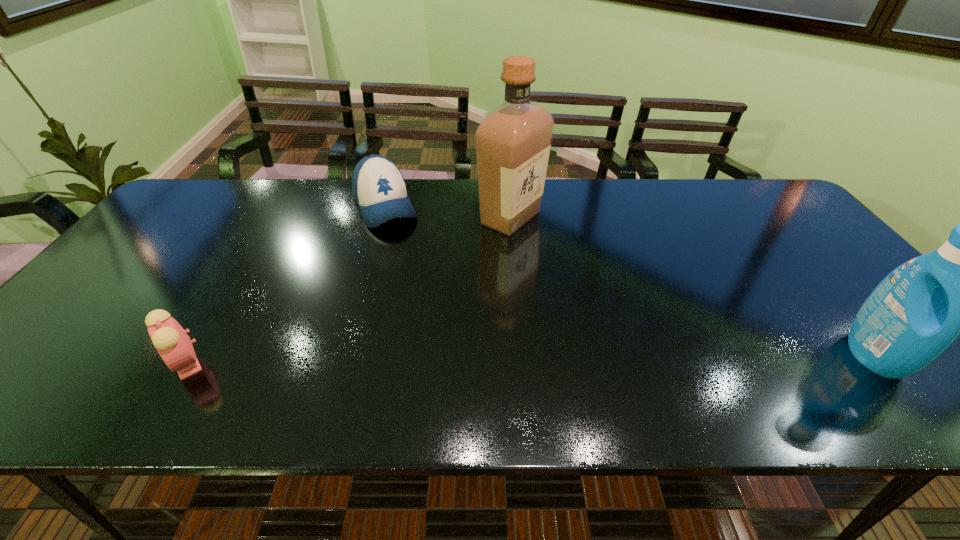
I want to click on object that is positioned at the right edge, so click(919, 310).

Identify the location of object that is at the near right corner. (919, 310).

This screenshot has width=960, height=540. I want to click on vacant space at the far edge of the desktop, so click(433, 217).

Locate an element on the screen. free spot at the near edge of the desktop is located at coordinates (682, 359).

Locate an element on the screen. The height and width of the screenshot is (540, 960). vacant space at the left edge of the desktop is located at coordinates (78, 309).

Identify the location of vacant position at the far right corner of the desktop. The image size is (960, 540). (766, 212).

I want to click on free space that is in between the alarm clock and the baseball cap, so click(x=285, y=285).

This screenshot has height=540, width=960. I want to click on free spot between the alarm clock and the rightmost object, so click(x=530, y=359).

Where is `vacant area between the baseball cap and the third object from left to right`? vacant area between the baseball cap and the third object from left to right is located at coordinates (448, 212).

Image resolution: width=960 pixels, height=540 pixels. In order to click on blank region between the alarm clock and the third shortest object in this screenshot , I will do `click(530, 359)`.